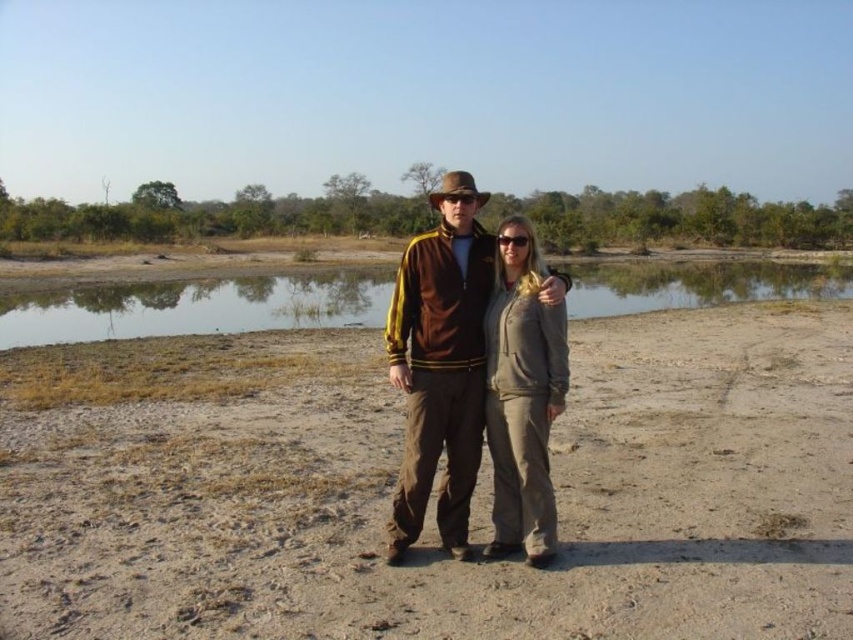
Question: Does brown sandy dirt at center appear over light gray fleece pants at center?

Choices:
 (A) no
 (B) yes

Answer: (A)

Question: From the image, what is the correct spatial relationship of clear water at center in relation to brown suede jacket at center?

Choices:
 (A) right
 (B) left

Answer: (A)

Question: Which point is closer to the camera?

Choices:
 (A) clear water at center
 (B) light gray fleece pants at center

Answer: (B)

Question: From the image, what is the correct spatial relationship of brown suede jacket at center in relation to light gray fleece pants at center?

Choices:
 (A) right
 (B) left

Answer: (B)

Question: Which point is closer to the camera taking this photo?

Choices:
 (A) (465, 218)
 (B) (498, 296)
 (C) (271, 301)
 (D) (387, 403)

Answer: (A)

Question: Which point is closer to the camera?

Choices:
 (A) clear water at center
 (B) brown sandy dirt at center
 (C) light gray fleece pants at center
 (D) brown suede jacket at center

Answer: (B)